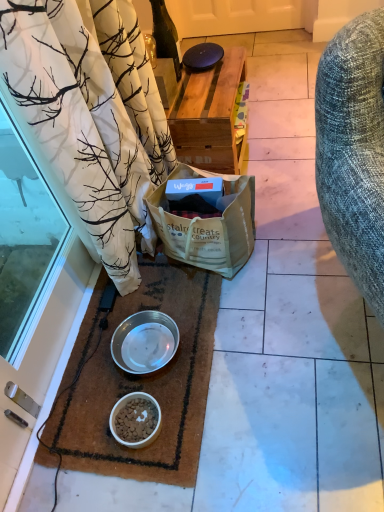
The image size is (384, 512). Find the location of `free point behind metallic silver bowl at lower center, arranged as the first bowl when viewed from the top`. free point behind metallic silver bowl at lower center, arranged as the first bowl when viewed from the top is located at coordinates (140, 298).